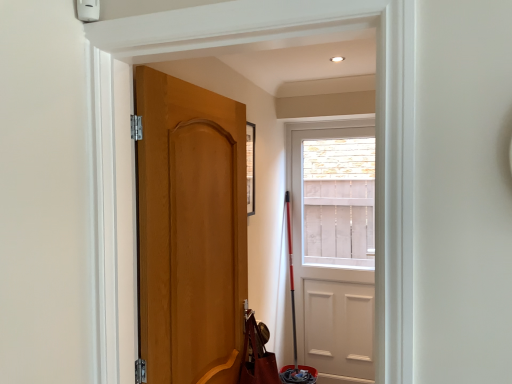
Question: Does white matte door at center, which is counted as the 2th door, starting from the left, have a greater width compared to brown leather shoulder bag at lower left?

Choices:
 (A) no
 (B) yes

Answer: (A)

Question: From a real-world perspective, is white matte door at center, which is counted as the 2th door, starting from the left, beneath brown leather shoulder bag at lower left?

Choices:
 (A) yes
 (B) no

Answer: (B)

Question: Is white matte door at center, placed as the 2th door when sorted from front to back, positioned far away from brown leather shoulder bag at lower left?

Choices:
 (A) no
 (B) yes

Answer: (B)

Question: Can you confirm if white matte door at center, which appears as the 1th door when viewed from the back, is thinner than brown leather shoulder bag at lower left?

Choices:
 (A) yes
 (B) no

Answer: (A)

Question: Does white matte door at center, placed as the 2th door when sorted from front to back, have a lesser height compared to brown leather shoulder bag at lower left?

Choices:
 (A) yes
 (B) no

Answer: (B)

Question: Based on their positions, is white matte door at center, placed as the 2th door when sorted from front to back, located to the left or right of brown leather shoulder bag at lower left?

Choices:
 (A) left
 (B) right

Answer: (B)

Question: From a real-world perspective, is white matte door at center, which is counted as the 2th door, starting from the left, above or below brown leather shoulder bag at lower left?

Choices:
 (A) below
 (B) above

Answer: (B)

Question: Relative to brown leather shoulder bag at lower left, is white matte door at center, which appears as the 1th door when viewed from the back, in front or behind?

Choices:
 (A) behind
 (B) front

Answer: (A)

Question: Looking at their shapes, would you say white matte door at center, which is counted as the 2th door, starting from the left, is wider or thinner than brown leather shoulder bag at lower left?

Choices:
 (A) thin
 (B) wide

Answer: (A)

Question: Considering the relative positions of matte wood door at center, which is the second door from right to left, and brown leather shoulder bag at lower left in the image provided, is matte wood door at center, which is the second door from right to left, to the left or to the right of brown leather shoulder bag at lower left?

Choices:
 (A) right
 (B) left

Answer: (B)

Question: Considering the positions of point [202, 140] and point [260, 360], is point [202, 140] closer or farther from the camera than point [260, 360]?

Choices:
 (A) closer
 (B) farther

Answer: (A)

Question: Is matte wood door at center, which is the second door from right to left, taller or shorter than brown leather shoulder bag at lower left?

Choices:
 (A) short
 (B) tall

Answer: (B)

Question: Is matte wood door at center, which ranks as the second door in back-to-front order, situated inside brown leather shoulder bag at lower left or outside?

Choices:
 (A) outside
 (B) inside

Answer: (A)

Question: Is point (274, 375) closer or farther from the camera than point (325, 289)?

Choices:
 (A) closer
 (B) farther

Answer: (A)

Question: From a real-world perspective, is brown leather shoulder bag at lower left physically located above or below white matte door at center, which is counted as the 2th door, starting from the left?

Choices:
 (A) above
 (B) below

Answer: (B)